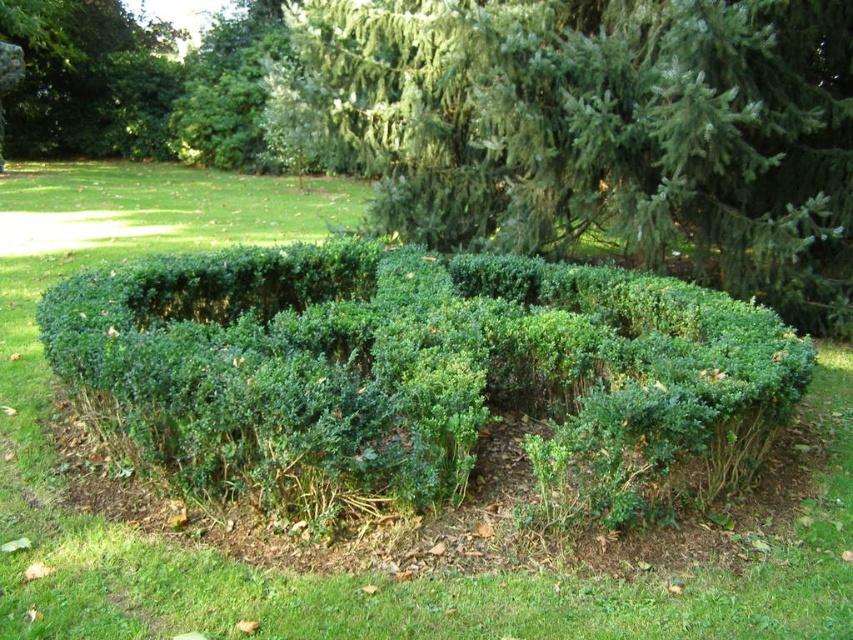
Question: Which is farther from the green leafy tree at center?

Choices:
 (A) green leafy bush at upper left
 (B) green leafy hedge at center

Answer: (A)

Question: Does green leafy tree at center appear under green leafy bush at upper left?

Choices:
 (A) yes
 (B) no

Answer: (A)

Question: Which of the following is the closest to the observer?

Choices:
 (A) green leafy tree at center
 (B) green leafy hedge at center

Answer: (B)

Question: Which object is farther from the camera taking this photo?

Choices:
 (A) green leafy bush at upper left
 (B) green leafy tree at center
 (C) green leafy hedge at center

Answer: (A)

Question: Can you confirm if green leafy tree at center is positioned to the right of green leafy bush at upper left?

Choices:
 (A) yes
 (B) no

Answer: (A)

Question: Is green leafy tree at center to the left of green leafy bush at upper left from the viewer's perspective?

Choices:
 (A) no
 (B) yes

Answer: (A)